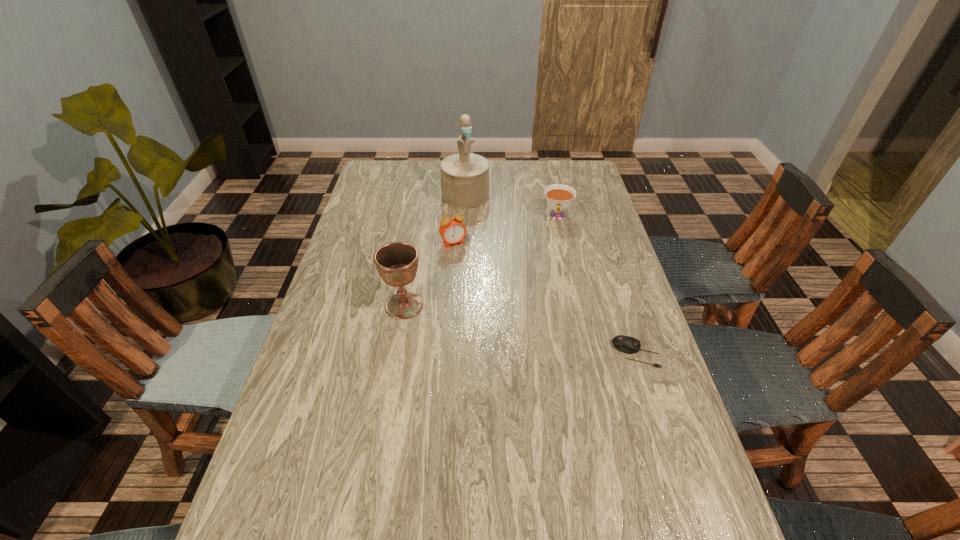
Where is `vacant space that satisfies the following two spatial constraints: 1. on the back side of the leftmost object; 2. on the right side of the figurine`? The width and height of the screenshot is (960, 540). vacant space that satisfies the following two spatial constraints: 1. on the back side of the leftmost object; 2. on the right side of the figurine is located at coordinates (423, 195).